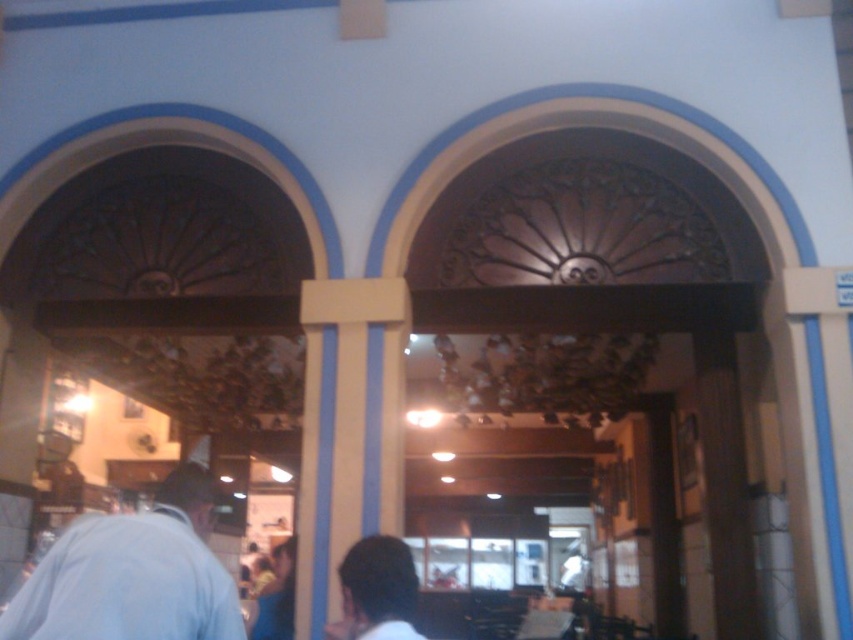
You are a photographer trying to capture a group photo of people in the scene. You notice the light blue shirt at lower left and the dark brown hair at lower center. Which object should you position closer to the camera to ensure both are fully visible in the frame?

You should position the light blue shirt at lower left closer to the camera because it might be wider than the dark brown hair at lower center, ensuring both fit within the frame.